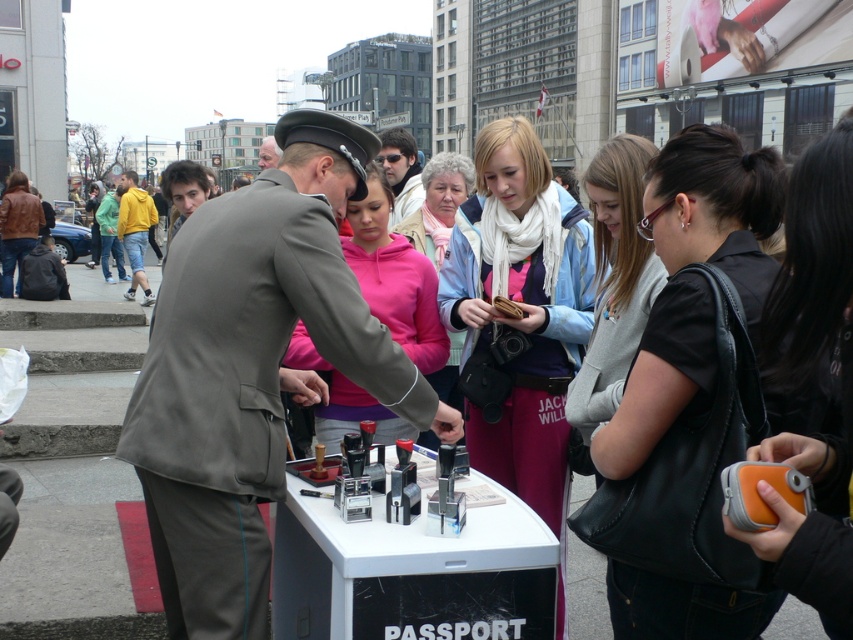
Question: Which point appears farthest from the camera in this image?

Choices:
 (A) [155, 545]
 (B) [393, 225]
 (C) [21, 189]
 (D) [480, 208]

Answer: (C)

Question: Is matte black purse at center in front of matte black jacket at center?

Choices:
 (A) no
 (B) yes

Answer: (B)

Question: Is white scarf at center to the left of matte black jacket at center from the viewer's perspective?

Choices:
 (A) no
 (B) yes

Answer: (A)

Question: Which of the following is the farthest from the observer?

Choices:
 (A) (486, 170)
 (B) (715, 166)
 (C) (20, 252)

Answer: (C)

Question: Which point is closer to the camera?

Choices:
 (A) (375, 160)
 (B) (621, 412)
 (C) (596, 172)

Answer: (B)

Question: Is matte black purse at center positioned behind pink fleece jacket at center?

Choices:
 (A) no
 (B) yes

Answer: (A)